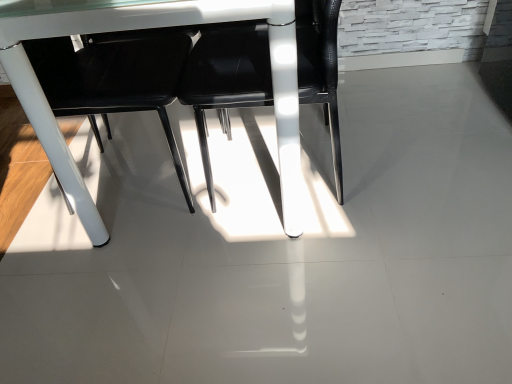
Question: Are black leather chair at center, which is the first chair from right to left, and black leather chair at center, which is the 1th chair from left to right, making contact?

Choices:
 (A) yes
 (B) no

Answer: (B)

Question: Considering the relative positions of black leather chair at center, which is the first chair from right to left, and black leather chair at center, which is the 1th chair from left to right, in the image provided, is black leather chair at center, which is the first chair from right to left, to the right of black leather chair at center, which is the 1th chair from left to right, from the viewer's perspective?

Choices:
 (A) yes
 (B) no

Answer: (A)

Question: Is black leather chair at center, which is the first chair from right to left, aimed at black leather chair at center, which is the 1th chair from left to right?

Choices:
 (A) yes
 (B) no

Answer: (A)

Question: Does black leather chair at center, which is the first chair from right to left, have a smaller size compared to black leather chair at center, which is the 1th chair from left to right?

Choices:
 (A) no
 (B) yes

Answer: (B)

Question: Is black leather chair at center, which appears as the 2th chair when viewed from the left, completely or partially outside of black leather chair at center, the 2th chair positioned from the right?

Choices:
 (A) no
 (B) yes

Answer: (B)

Question: Is black leather chair at center, which appears as the 2th chair when viewed from the left, wider than black leather chair at center, which is the 1th chair from left to right?

Choices:
 (A) no
 (B) yes

Answer: (A)

Question: Is white glossy table at center beside black leather chair at center, the 2th chair positioned from the right?

Choices:
 (A) yes
 (B) no

Answer: (B)

Question: Can you confirm if white glossy table at center is shorter than black leather chair at center, which is the 1th chair from left to right?

Choices:
 (A) no
 (B) yes

Answer: (A)

Question: Is white glossy table at center further to the viewer compared to black leather chair at center, which is the 1th chair from left to right?

Choices:
 (A) no
 (B) yes

Answer: (A)

Question: Does white glossy table at center have a greater height compared to black leather chair at center, which is the 1th chair from left to right?

Choices:
 (A) yes
 (B) no

Answer: (A)

Question: Does white glossy table at center come in front of black leather chair at center, the 2th chair positioned from the right?

Choices:
 (A) no
 (B) yes

Answer: (B)

Question: Is white glossy table at center positioned far away from black leather chair at center, the 2th chair positioned from the right?

Choices:
 (A) no
 (B) yes

Answer: (A)

Question: Can you confirm if black leather chair at center, which is the 1th chair from left to right, is wider than white glossy table at center?

Choices:
 (A) yes
 (B) no

Answer: (B)